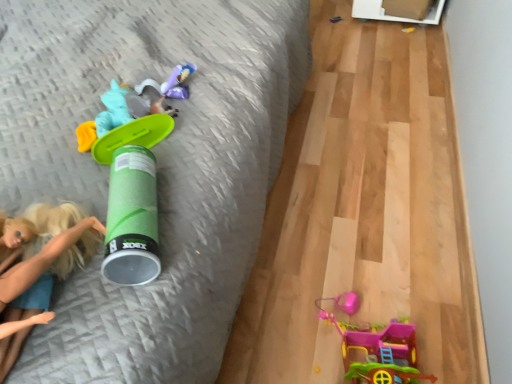
Looking at this image, what is the approximate width of green matte canister at center, acting as the first toy starting from the front?

24.19 centimeters.

Describe the element at coordinates (42, 265) in the screenshot. Image resolution: width=512 pixels, height=384 pixels. I see `blonde hair doll at left` at that location.

What do you see at coordinates (376, 347) in the screenshot?
I see `plastic pink toy house at lower right, the fourth toy from the left` at bounding box center [376, 347].

Locate an element on the screen. green matte canister at center, which is the second toy in bottom-to-top order is located at coordinates (132, 199).

Looking at this image, looking at the image, does green plastic toy at upper left, positioned as the third toy in back-to-front order, seem bigger or smaller compared to matte purple plush at center, placed as the fourth toy when sorted from front to back?

In the image, green plastic toy at upper left, positioned as the third toy in back-to-front order, appears to be larger than matte purple plush at center, placed as the fourth toy when sorted from front to back.

The image size is (512, 384). I want to click on the 1st toy counting from the right side of the green plastic toy at upper left, which is the 3th toy in bottom-to-top order, so click(x=178, y=82).

Is green matte canister at center, acting as the first toy starting from the front, shorter than green plastic bed frame at left?

No, green matte canister at center, acting as the first toy starting from the front, is not shorter than green plastic bed frame at left.

Find the location of a particular element. bed frame lying on the right of green matte canister at center, placed as the third toy when sorted from right to left is located at coordinates (157, 166).

Which of these two, green matte canister at center, the fifth toy viewed from the back, or green plastic bed frame at left, is bigger?

Bigger between the two is green plastic bed frame at left.

Considering the positions of objects matte purple plush at center, which ranks as the 2th toy in back-to-front order, and green plastic bed frame at left in the image provided, who is more to the left, matte purple plush at center, which ranks as the 2th toy in back-to-front order, or green plastic bed frame at left?

Positioned to the left is matte purple plush at center, which ranks as the 2th toy in back-to-front order.

From the image's perspective, is matte purple plush at center, the fourth toy positioned from the bottom, on green plastic bed frame at left?

No, from the image's perspective, matte purple plush at center, the fourth toy positioned from the bottom, is not over green plastic bed frame at left.

Measure the distance from matte purple plush at center, which ranks as the fourth toy in right-to-left order, to green plastic bed frame at left.

matte purple plush at center, which ranks as the fourth toy in right-to-left order, and green plastic bed frame at left are 11.46 inches apart from each other.

Can we say matte purple plush at center, the second toy when ordered from top to bottom, lies outside green plastic bed frame at left?

That's correct, matte purple plush at center, the second toy when ordered from top to bottom, is outside of green plastic bed frame at left.

Considering the sizes of plastic pink toy house at lower right, which ranks as the first toy in bottom-to-top order, and matte purple plush at center, the second toy when ordered from top to bottom, in the image, is plastic pink toy house at lower right, which ranks as the first toy in bottom-to-top order, wider or thinner than matte purple plush at center, the second toy when ordered from top to bottom,?

Considering their sizes, plastic pink toy house at lower right, which ranks as the first toy in bottom-to-top order, looks broader than matte purple plush at center, the second toy when ordered from top to bottom.

From a real-world perspective, who is located higher, plastic pink toy house at lower right, the fourth toy from the left, or matte purple plush at center, the second toy from the left?

matte purple plush at center, the second toy from the left, from a real-world perspective.

Does plastic pink toy house at lower right, the fourth toy from the left, contain matte purple plush at center, placed as the fourth toy when sorted from front to back?

No, matte purple plush at center, placed as the fourth toy when sorted from front to back, is not surrounded by plastic pink toy house at lower right, the fourth toy from the left.

Measure the distance between plastic pink toy house at lower right, the 2th toy in the front-to-back sequence, and matte purple plush at center, placed as the fourth toy when sorted from front to back.

plastic pink toy house at lower right, the 2th toy in the front-to-back sequence, is 25.86 inches from matte purple plush at center, placed as the fourth toy when sorted from front to back.

Is blonde hair doll at left located within green plastic bed frame at left?

Actually, blonde hair doll at left is outside green plastic bed frame at left.

From a real-world perspective, is green plastic bed frame at left on top of blonde hair doll at left?

Incorrect, from a real-world perspective, green plastic bed frame at left is lower than blonde hair doll at left.

Locate an element on the screen. The height and width of the screenshot is (384, 512). bed frame behind the blonde hair doll at left is located at coordinates (157, 166).

How much distance is there between green plastic bed frame at left and blonde hair doll at left?

green plastic bed frame at left and blonde hair doll at left are 14.48 inches apart.

From a real-world perspective, between metallic silver toy at upper right, which appears as the 5th toy when ordered from the bottom, and green matte canister at center, acting as the first toy starting from the front, who is vertically lower?

metallic silver toy at upper right, which appears as the 5th toy when ordered from the bottom, is physically lower.

Who is smaller, metallic silver toy at upper right, marked as the fifth toy in a front-to-back arrangement, or green matte canister at center, the fifth toy viewed from the back?

With smaller size is metallic silver toy at upper right, marked as the fifth toy in a front-to-back arrangement.

The height and width of the screenshot is (384, 512). In order to click on the 4th toy behind when counting from the green matte canister at center, positioned as the fourth toy in top-to-bottom order in this screenshot , I will do `click(335, 19)`.

Are matte purple plush at center, the second toy when ordered from top to bottom, and plastic pink toy house at lower right, which ranks as the first toy in bottom-to-top order, located far from each other?

No, matte purple plush at center, the second toy when ordered from top to bottom, is in close proximity to plastic pink toy house at lower right, which ranks as the first toy in bottom-to-top order.

Is matte purple plush at center, which ranks as the 2th toy in back-to-front order, facing towards plastic pink toy house at lower right, the 2th toy in the front-to-back sequence?

No, matte purple plush at center, which ranks as the 2th toy in back-to-front order, is not aimed at plastic pink toy house at lower right, the 2th toy in the front-to-back sequence.

From a real-world perspective, is matte purple plush at center, the second toy from the left, beneath plastic pink toy house at lower right, the 2th toy in the front-to-back sequence?

No, from a real-world perspective, matte purple plush at center, the second toy from the left, is not under plastic pink toy house at lower right, the 2th toy in the front-to-back sequence.

Visually, is matte purple plush at center, the fourth toy positioned from the bottom, positioned to the left or to the right of plastic pink toy house at lower right, the fourth toy from the left?

Based on their positions, matte purple plush at center, the fourth toy positioned from the bottom, is located to the left of plastic pink toy house at lower right, the fourth toy from the left.

Identify the location of the 1st toy below the matte purple plush at center, placed as the fourth toy when sorted from front to back (from the image's perspective). (120, 125).

Image resolution: width=512 pixels, height=384 pixels. What are the coordinates of `the 3rd toy in front of the green plastic bed frame at left, counting from the anchor's position` in the screenshot? It's located at (132, 199).

Which object lies nearer to the anchor point matte purple plush at center, placed as the fourth toy when sorted from front to back, green plastic bed frame at left or plastic pink toy house at lower right, which ranks as the first toy in bottom-to-top order?

The object closer to matte purple plush at center, placed as the fourth toy when sorted from front to back, is green plastic bed frame at left.

From the image, which object appears to be farther from metallic silver toy at upper right, acting as the 5th toy starting from the left, green matte canister at center, which is the second toy in bottom-to-top order, or green plastic bed frame at left?

Based on the image, green matte canister at center, which is the second toy in bottom-to-top order, appears to be further to metallic silver toy at upper right, acting as the 5th toy starting from the left.

Which object lies further to the anchor point blonde hair doll at left, matte purple plush at center, placed as the fourth toy when sorted from front to back, or green matte canister at center, positioned as the fourth toy in top-to-bottom order?

Among the two, matte purple plush at center, placed as the fourth toy when sorted from front to back, is located further to blonde hair doll at left.

Based on their spatial positions, is matte purple plush at center, which ranks as the 2th toy in back-to-front order, or blonde hair doll at left closer to metallic silver toy at upper right, the first toy when ordered from right to left?

matte purple plush at center, which ranks as the 2th toy in back-to-front order, is positioned closer to the anchor metallic silver toy at upper right, the first toy when ordered from right to left.

From the image, which object appears to be nearer to green plastic bed frame at left, green plastic toy at upper left, positioned as the third toy in back-to-front order, or matte purple plush at center, the second toy from the left?

Based on the image, green plastic toy at upper left, positioned as the third toy in back-to-front order, appears to be nearer to green plastic bed frame at left.

When comparing their distances from metallic silver toy at upper right, which appears as the 1th toy when viewed from the top, does plastic pink toy house at lower right, the 2th toy in the front-to-back sequence, or matte purple plush at center, which ranks as the 2th toy in back-to-front order, seem further?

plastic pink toy house at lower right, the 2th toy in the front-to-back sequence.

Considering their positions, is green plastic bed frame at left positioned further to plastic pink toy house at lower right, which ranks as the first toy in bottom-to-top order, than green plastic toy at upper left, which is the 3th toy in bottom-to-top order?

green plastic toy at upper left, which is the 3th toy in bottom-to-top order, lies further to plastic pink toy house at lower right, which ranks as the first toy in bottom-to-top order, than the other object.

Based on their spatial positions, is green plastic toy at upper left, positioned as the third toy in back-to-front order, or green matte canister at center, which is the second toy in bottom-to-top order, closer to matte purple plush at center, which ranks as the 2th toy in back-to-front order?

green plastic toy at upper left, positioned as the third toy in back-to-front order, lies closer to matte purple plush at center, which ranks as the 2th toy in back-to-front order, than the other object.

Find the location of a particular element. The image size is (512, 384). bed frame between blonde hair doll at left and plastic pink toy house at lower right, which ranks as the first toy in bottom-to-top order is located at coordinates (157, 166).

The width and height of the screenshot is (512, 384). I want to click on bed frame between green matte canister at center, the fifth toy viewed from the back, and metallic silver toy at upper right, which appears as the 5th toy when ordered from the bottom, along the z-axis, so coord(157,166).

Where is `bed frame located between green plastic toy at upper left, which is counted as the 1th toy, starting from the left, and metallic silver toy at upper right, marked as the fifth toy in a front-to-back arrangement, in the depth direction`? Image resolution: width=512 pixels, height=384 pixels. bed frame located between green plastic toy at upper left, which is counted as the 1th toy, starting from the left, and metallic silver toy at upper right, marked as the fifth toy in a front-to-back arrangement, in the depth direction is located at coordinates (157, 166).

The width and height of the screenshot is (512, 384). I want to click on bed frame between green plastic toy at upper left, which is counted as the 1th toy, starting from the left, and plastic pink toy house at lower right, which is the fifth toy in top-to-bottom order, from left to right, so click(x=157, y=166).